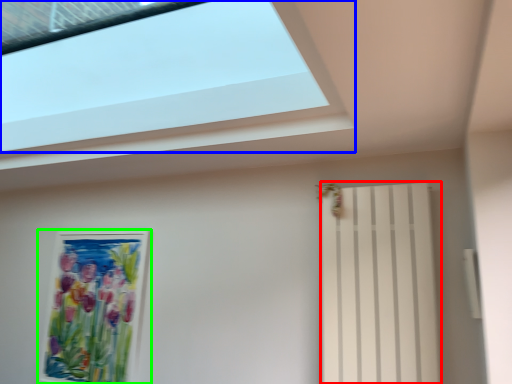
Question: Estimate the real-world distances between objects in this image. Which object is closer to shutter (highlighted by a red box), window (highlighted by a blue box) or picture frame (highlighted by a green box)?

Choices:
 (A) window
 (B) picture frame

Answer: (A)